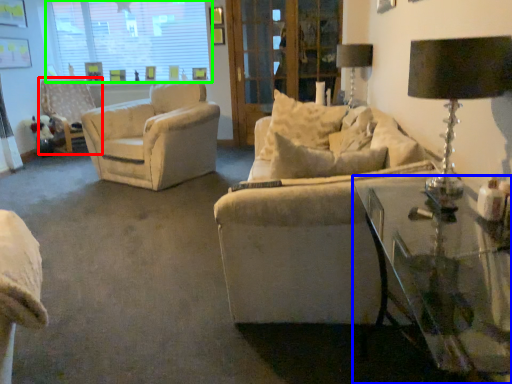
Question: Estimate the real-world distances between objects in this image. Which object is farther from chair (highlighted by a red box), table (highlighted by a blue box) or window (highlighted by a green box)?

Choices:
 (A) table
 (B) window

Answer: (A)